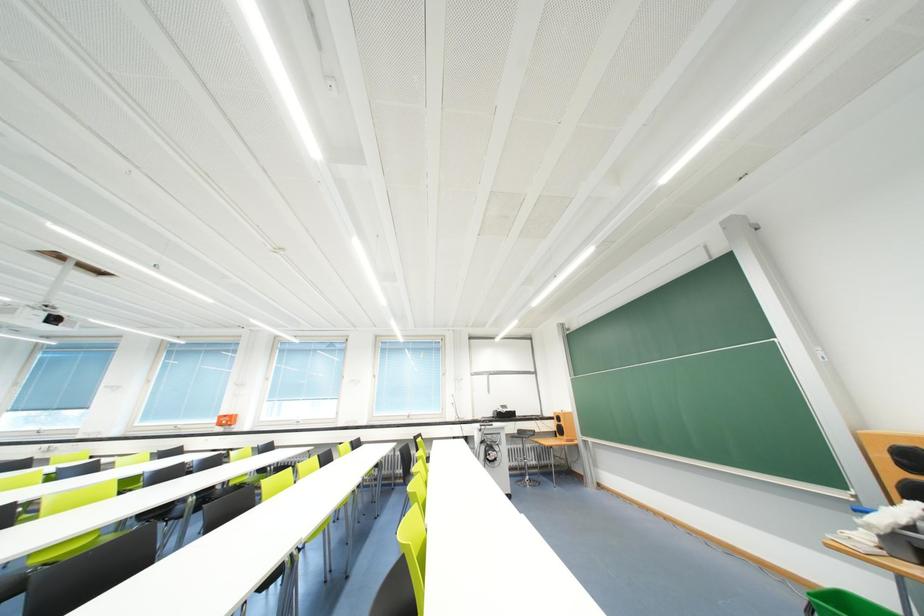
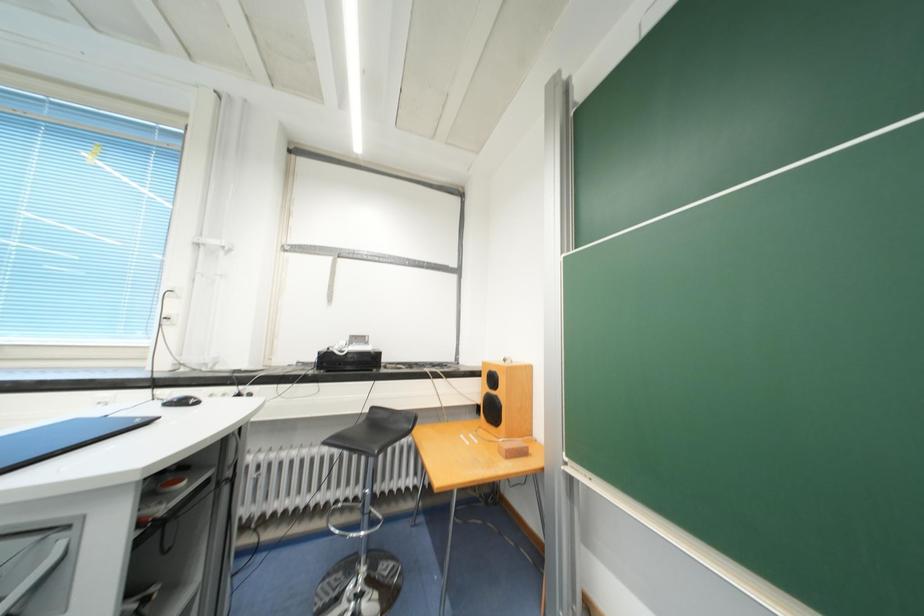
Which direction would the cameraman need to move to produce the second image?

The cameraman walked toward right, forward.